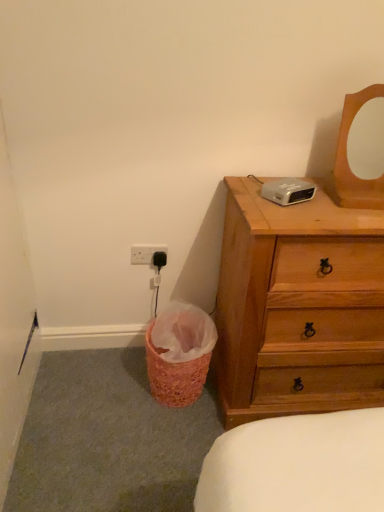
Question: Looking at their shapes, would you say wooden mirror at upper right is wider or thinner than wooden chest of drawers at right?

Choices:
 (A) wide
 (B) thin

Answer: (B)

Question: From their relative heights in the image, would you say wooden mirror at upper right is taller or shorter than wooden chest of drawers at right?

Choices:
 (A) tall
 (B) short

Answer: (B)

Question: Which of these objects is positioned farthest from the wooden chest of drawers at right?

Choices:
 (A) pink woven basket at lower left
 (B) white plastic electric outlet at lower left
 (C) wooden mirror at upper right

Answer: (B)

Question: Considering the real-world distances, which object is closest to the wooden mirror at upper right?

Choices:
 (A) pink woven basket at lower left
 (B) white plastic electric outlet at lower left
 (C) wooden chest of drawers at right

Answer: (C)